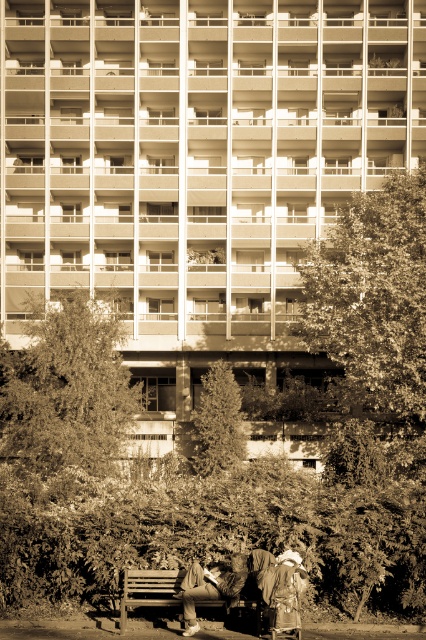
You are standing in the urban scene and want to walk from the wooden bench to the residential building. Which point, point (389,192) or point (221,584), is closer to you as you approach the building?

Point (389,192) is closer to you because it is further to the viewer than point (221,584), meaning it is physically nearer in the scene.